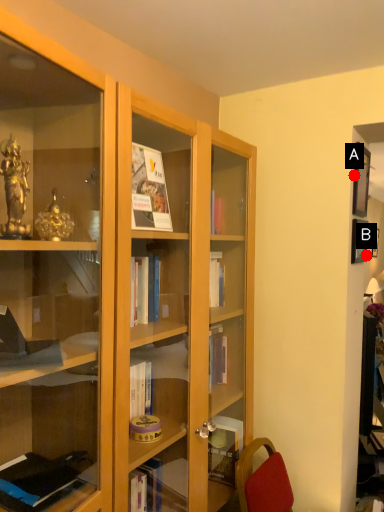
Question: Two points are circled on the image, labeled by A and B beside each circle. Which point is farther to the camera?

Choices:
 (A) A is further
 (B) B is further

Answer: (B)